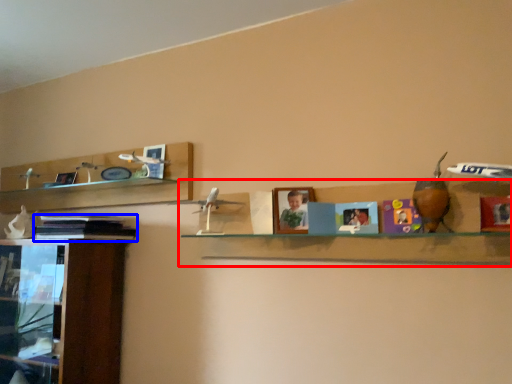
Question: Which of the following is the closest to the observer, shelf (highlighted by a red box) or book (highlighted by a blue box)?

Choices:
 (A) shelf
 (B) book

Answer: (A)